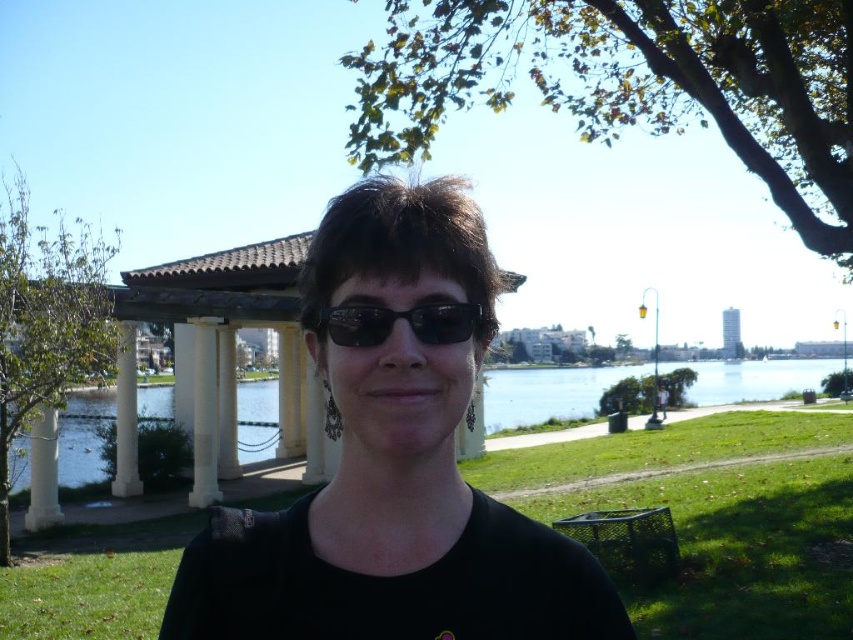
You are standing in the park and want to place a small statue exactly halfway between point (437, 234) and point (355, 340). Will the statue be closer to the person or the gazebo?

The statue placed halfway between point (437, 234) and point (355, 340) will be closer to the gazebo because point (437, 234) is closer to the person and further from the gazebo compared to point (355, 340).

Looking at this image, you are a photographer taking a portrait of the person in the scene. You want to focus on the black matte shirt at center and the black plastic sunglasses at center. Which object should you adjust your camera focus on first if you want to ensure both are in focus?

The black matte shirt at center is closer to the viewer than the black plastic sunglasses at center, so you should focus on the black matte shirt at center first to ensure both are in focus.